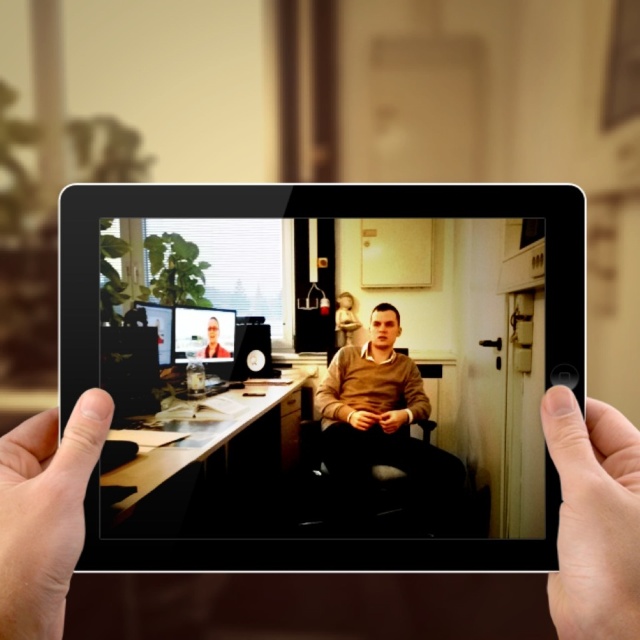
Question: Is the position of black glossy tablet computer at center less distant than that of matte black monitor at upper left?

Choices:
 (A) yes
 (B) no

Answer: (A)

Question: Is the position of smooth skin at lower left more distant than that of brown sweater at center?

Choices:
 (A) yes
 (B) no

Answer: (B)

Question: Among these points, which one is nearest to the camera?

Choices:
 (A) (232, 324)
 (B) (397, 372)
 (C) (138, 305)
 (D) (12, 488)

Answer: (D)

Question: Does brown sweater at center appear under matte black monitor at upper left?

Choices:
 (A) no
 (B) yes

Answer: (B)

Question: Which point is farther from the camera taking this photo?

Choices:
 (A) (609, 413)
 (B) (148, 305)
 (C) (392, 403)
 (D) (216, 353)

Answer: (D)

Question: Considering the real-world distances, which object is farthest from the matte plastic computer screen at center?

Choices:
 (A) smooth skin hand at right
 (B) brown sweater at center

Answer: (A)